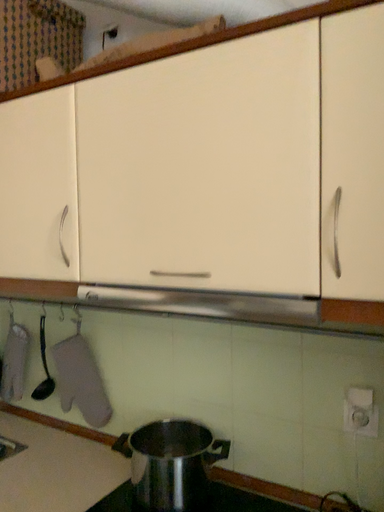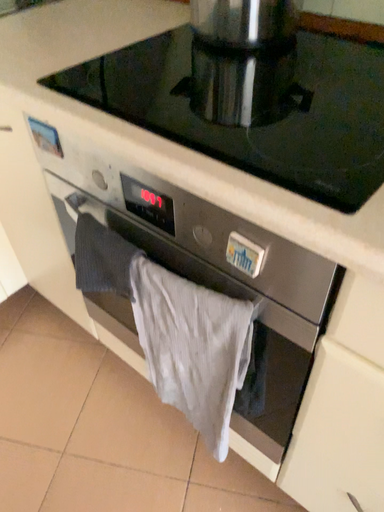
Question: Which way did the camera rotate in the video?

Choices:
 (A) rotated left
 (B) rotated right

Answer: (A)